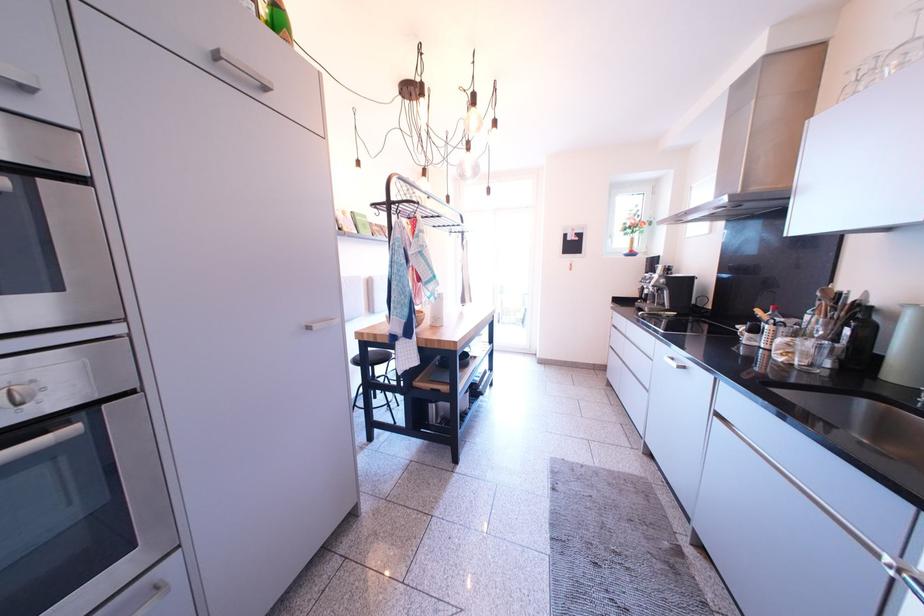
What do you see at coordinates (17, 395) in the screenshot? I see `a silver oven dial` at bounding box center [17, 395].